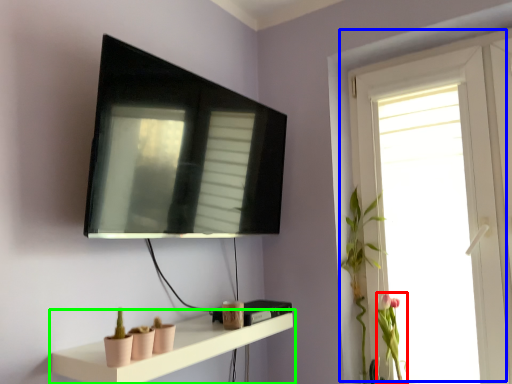
Question: Which is nearer to the plant (highlighted by a red box)? window (highlighted by a blue box) or shelf (highlighted by a green box).

Choices:
 (A) window
 (B) shelf

Answer: (A)